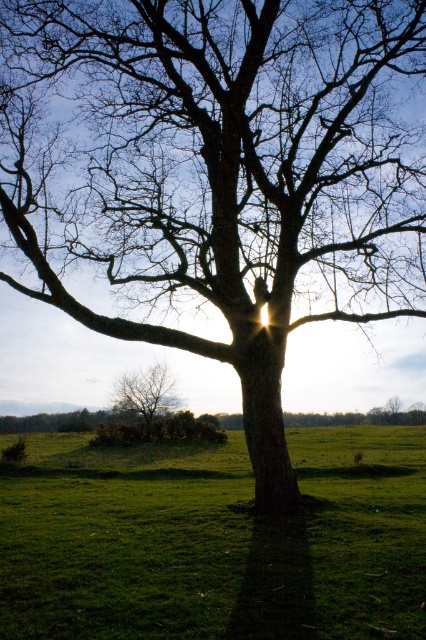
Question: Is green grass at center smaller than smooth bark tree at lower left?

Choices:
 (A) no
 (B) yes

Answer: (A)

Question: Can you confirm if green grass at center is wider than smooth bark tree at lower left?

Choices:
 (A) yes
 (B) no

Answer: (A)

Question: Does green grass at center appear under smooth bark tree at lower left?

Choices:
 (A) yes
 (B) no

Answer: (A)